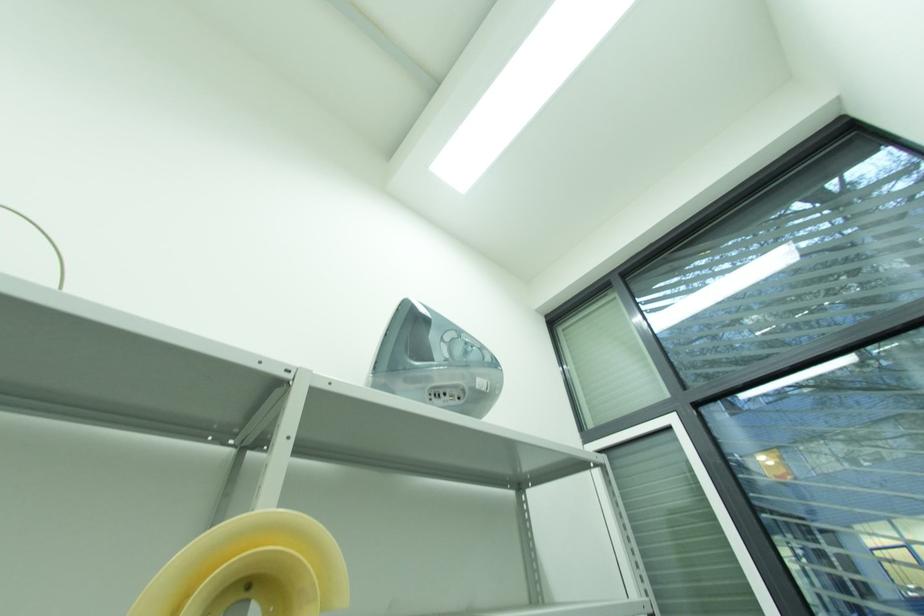
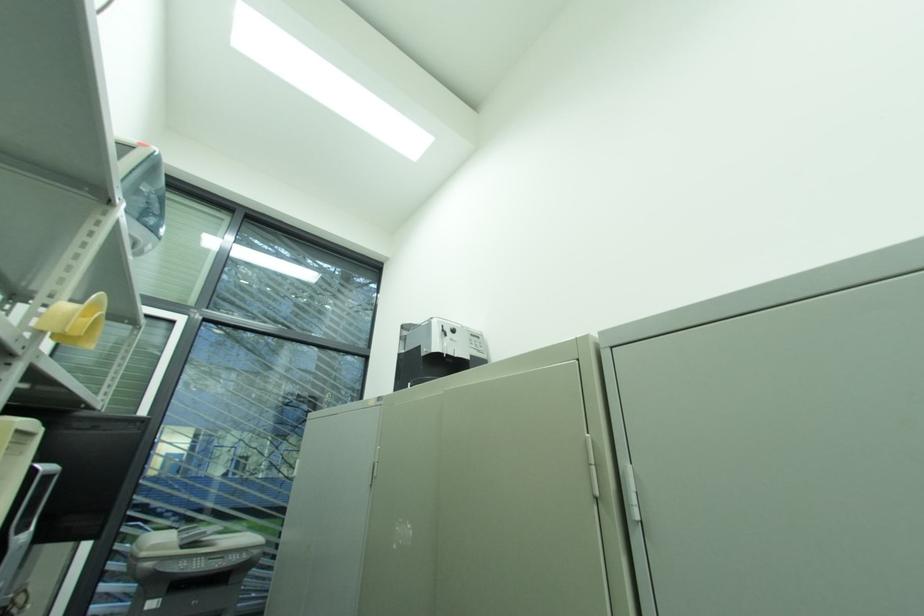
The first image is from the beginning of the video and the second image is from the end. How did the camera likely rotate when shooting the video?

The rotation direction of the camera is right-up.